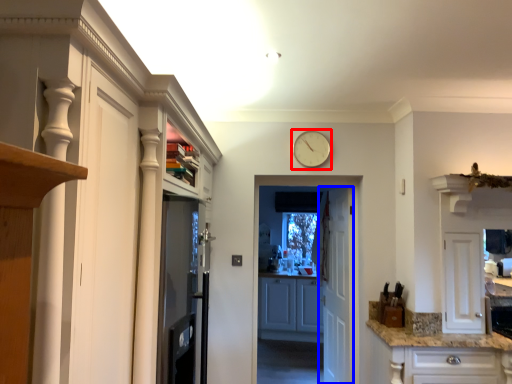
Question: Which point is closer to the camera, clock (highlighted by a red box) or door (highlighted by a blue box)?

Choices:
 (A) clock
 (B) door

Answer: (A)